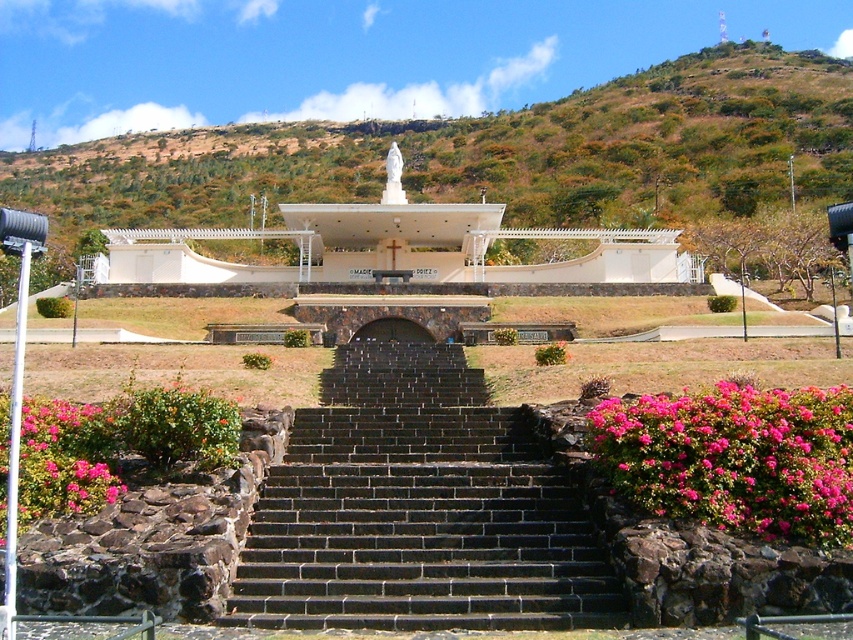
Is green leafy hillside at upper center behind black brick stairs at center?

Yes.

You are a GUI agent. You are given a task and a screenshot of the screen. Output one action in this format:
    pyautogui.click(x=<x>, y=<y>)
    Task: Click on the green leafy hillside at upper center
    
    Given the screenshot: What is the action you would take?
    pyautogui.click(x=492, y=154)

Is black brick stairs at center in front of pink matte flowers at lower left?

Yes, it is in front of pink matte flowers at lower left.

Can you confirm if black brick stairs at center is positioned below pink matte flowers at lower left?

Incorrect, black brick stairs at center is not positioned below pink matte flowers at lower left.

Who is more distant from viewer, (x=378, y=416) or (x=70, y=467)?

The point (x=378, y=416) is more distant.

Locate an element on the screen. black brick stairs at center is located at coordinates (416, 509).

Looking at this image, which of these two, pink matte flowers at lower right or pink matte flowers at lower left, stands taller?

Standing taller between the two is pink matte flowers at lower right.

Who is more forward, [699,417] or [93,456]?

Point [699,417] is in front.

Locate an element on the screen. The height and width of the screenshot is (640, 853). pink matte flowers at lower right is located at coordinates (734, 458).